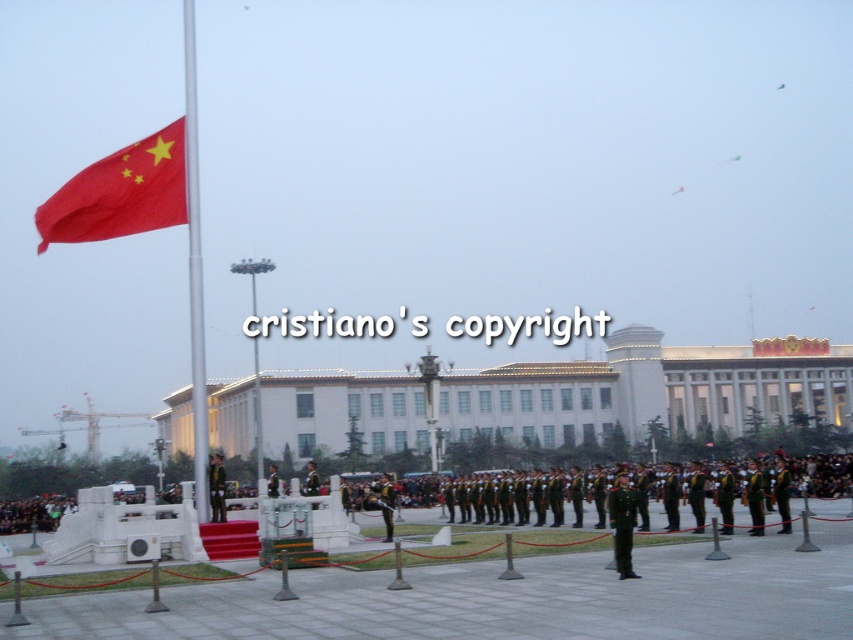
Question: Can you confirm if red matte flag at upper left is positioned above camouflage uniform at center?

Choices:
 (A) yes
 (B) no

Answer: (A)

Question: Can you confirm if red matte flag at upper left is positioned above green uniform at center?

Choices:
 (A) no
 (B) yes

Answer: (B)

Question: Which object is the farthest from the green military uniform at center?

Choices:
 (A) red matte flag at upper left
 (B) camouflage uniform at center

Answer: (B)

Question: Which point is farther to the camera?

Choices:
 (A) (381, 492)
 (B) (161, 205)
 (C) (219, 484)
 (D) (190, 300)

Answer: (A)

Question: Among these objects, which one is nearest to the camera?

Choices:
 (A) silver metallic flag pole at left
 (B) green uniform at center
 (C) camouflage uniform at center

Answer: (C)

Question: Does camouflage uniform at center have a smaller size compared to green military uniform at center?

Choices:
 (A) yes
 (B) no

Answer: (A)